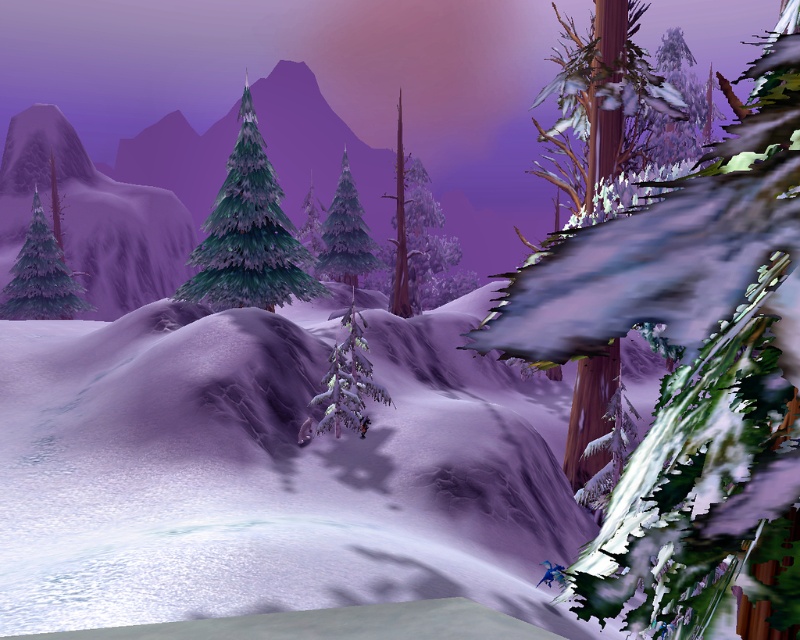
Which is more to the right, green matte tree at center or shiny black snowboard at center?

shiny black snowboard at center is more to the right.

This screenshot has width=800, height=640. What do you see at coordinates (345, 234) in the screenshot? I see `green matte tree at center` at bounding box center [345, 234].

Locate an element on the screen. The width and height of the screenshot is (800, 640). green matte tree at center is located at coordinates 345,234.

The image size is (800, 640). Find the location of `green matte tree at center`. green matte tree at center is located at coordinates (345, 234).

Who is shorter, snow-covered bark tree at right or blue plastic snowboard at lower right?

Standing shorter between the two is blue plastic snowboard at lower right.

Can you confirm if snow-covered bark tree at right is taller than blue plastic snowboard at lower right?

Correct, snow-covered bark tree at right is much taller as blue plastic snowboard at lower right.

Locate an element on the screen. This screenshot has height=640, width=800. snow-covered bark tree at right is located at coordinates (694, 371).

This screenshot has width=800, height=640. Identify the location of snow-covered bark tree at right. (694, 371).

Does snow-covered bark tree at right appear over snow-covered pine at center?

Yes.

Based on the photo, is snow-covered bark tree at right taller than snow-covered pine at center?

Yes.

The image size is (800, 640). Find the location of `snow-covered bark tree at right`. snow-covered bark tree at right is located at coordinates pyautogui.click(x=694, y=371).